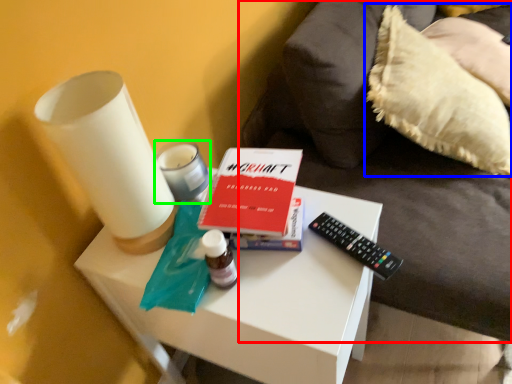
Question: Estimate the real-world distances between objects in this image. Which object is closer to furniture (highlighted by a red box), pillow (highlighted by a blue box) or candle holder (highlighted by a green box)?

Choices:
 (A) pillow
 (B) candle holder

Answer: (A)